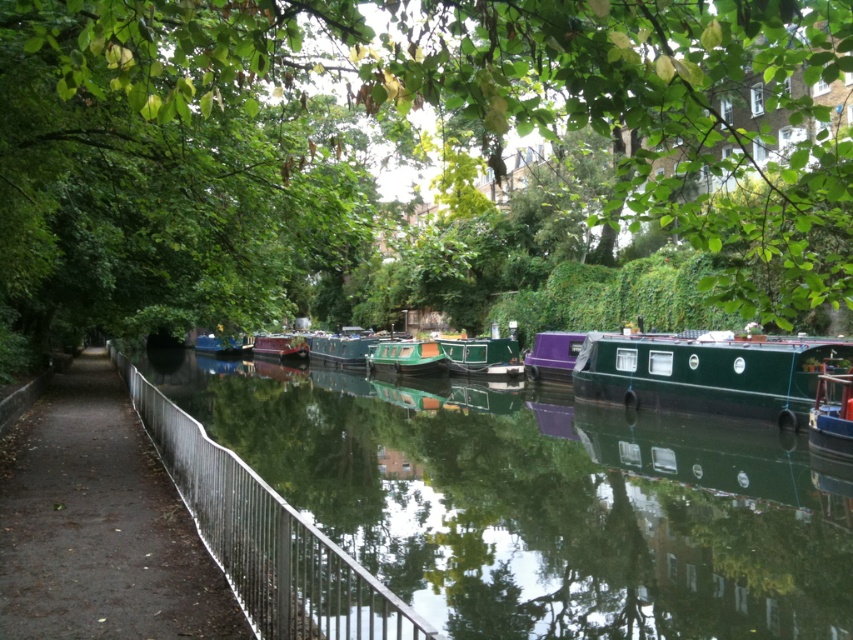
Question: Is green glossy barge at center positioned in front of shiny purple boat at center?

Choices:
 (A) yes
 (B) no

Answer: (A)

Question: Can you confirm if metallic fence at left is positioned below metallic green boat at right?

Choices:
 (A) no
 (B) yes

Answer: (B)

Question: Which point is closer to the camera taking this photo?

Choices:
 (A) (410, 339)
 (B) (839, 451)
 (C) (262, 337)

Answer: (B)

Question: Is green leafy tree at center to the right of green glossy boat at center from the viewer's perspective?

Choices:
 (A) no
 (B) yes

Answer: (A)

Question: Which is farther from the green matte boat at center?

Choices:
 (A) metallic fence at left
 (B) silver metallic fence at center

Answer: (A)

Question: Which point appears farthest from the camera in this image?

Choices:
 (A) (177, 589)
 (B) (332, 356)
 (C) (848, 371)
 (D) (202, 84)

Answer: (B)